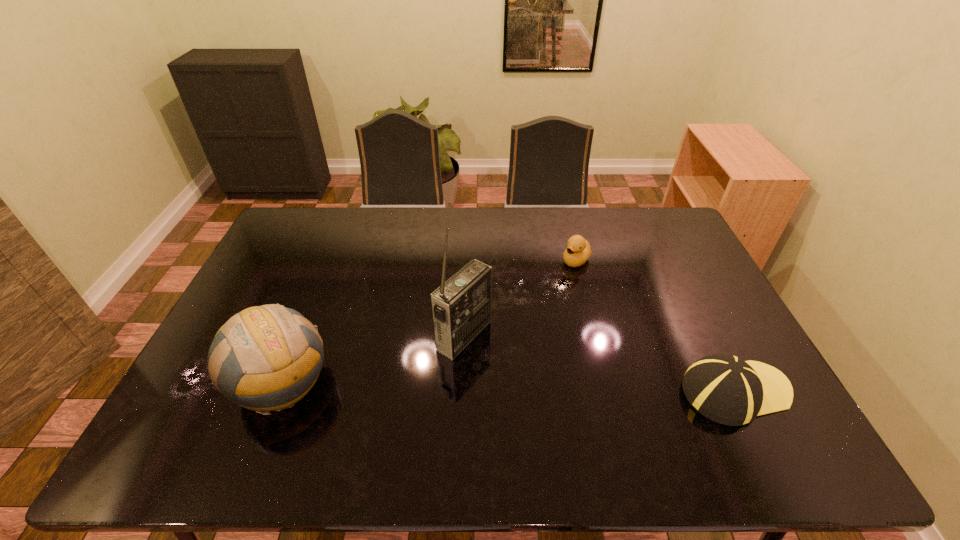
At what (x,y) coordinates should I click in order to perform the action: click on free space at the far edge of the desktop. Please return your answer as a coordinate pair (x, y). This screenshot has height=540, width=960. Looking at the image, I should click on (502, 207).

The image size is (960, 540). I want to click on free space at the near edge of the desktop, so click(363, 401).

This screenshot has width=960, height=540. In the image, there is a desktop. What are the coordinates of `vacant space at the far left corner` in the screenshot? It's located at (300, 239).

This screenshot has height=540, width=960. In the image, there is a desktop. What are the coordinates of `vacant space at the far right corner` in the screenshot? It's located at (664, 244).

Image resolution: width=960 pixels, height=540 pixels. What are the coordinates of `blank region between the third object from left to right and the rightmost object` in the screenshot? It's located at (657, 326).

You are a GUI agent. You are given a task and a screenshot of the screen. Output one action in this format:
    pyautogui.click(x=<x>, y=<y>)
    Task: Click on the free area in between the rightmost object and the leftmost object
    
    Given the screenshot: What is the action you would take?
    pyautogui.click(x=509, y=388)

The height and width of the screenshot is (540, 960). Identify the location of vacant area between the leftmost object and the radio receiver. (372, 359).

Where is `blank region between the volleyball and the baseball cap`? This screenshot has height=540, width=960. blank region between the volleyball and the baseball cap is located at coordinates (509, 388).

Image resolution: width=960 pixels, height=540 pixels. I want to click on vacant space that's between the leftmost object and the third object from right to left, so click(372, 359).

Where is `empty space that is in between the duckling and the tallest object`? The height and width of the screenshot is (540, 960). empty space that is in between the duckling and the tallest object is located at coordinates (520, 298).